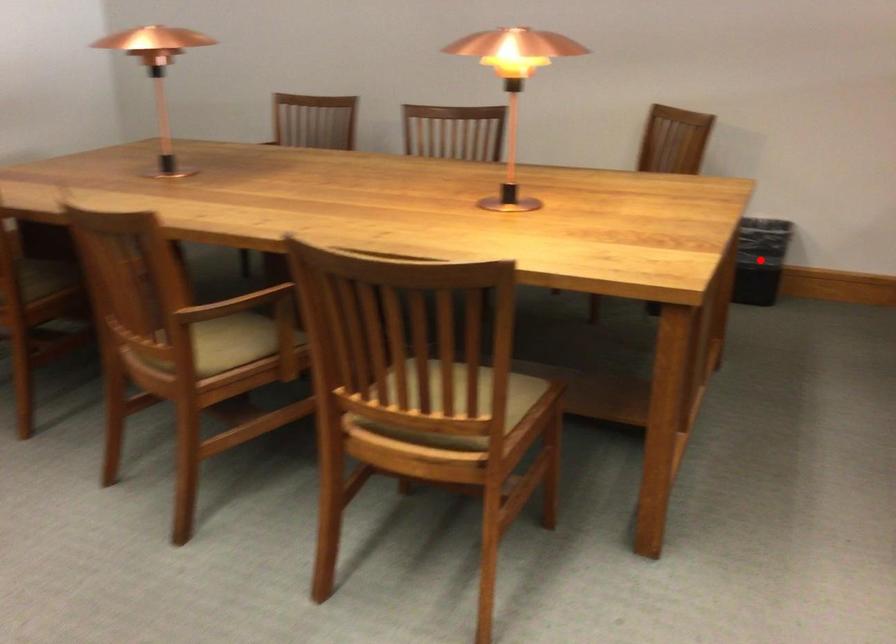
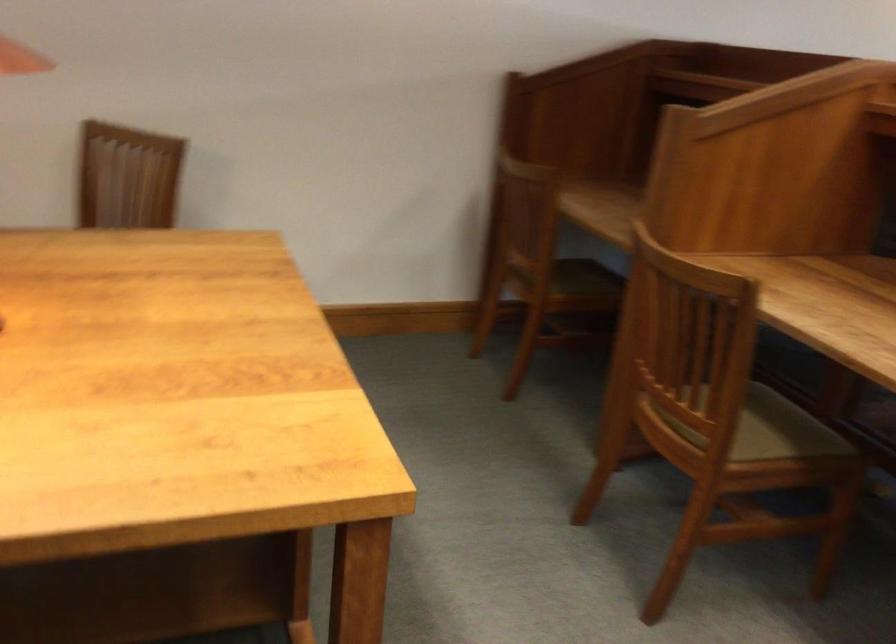
Question: I am providing you with two images of the same scene from different viewpoints. A red point is marked on the first image. Can you still see the location of the red point in image 2?

Choices:
 (A) Yes
 (B) No

Answer: (B)